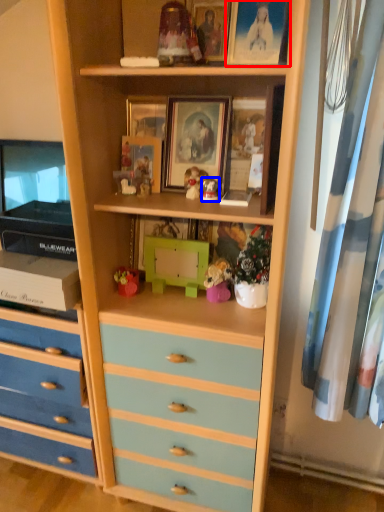
Question: Which point is further to the camera, picture frame (highlighted by a red box) or toy (highlighted by a blue box)?

Choices:
 (A) picture frame
 (B) toy

Answer: (B)